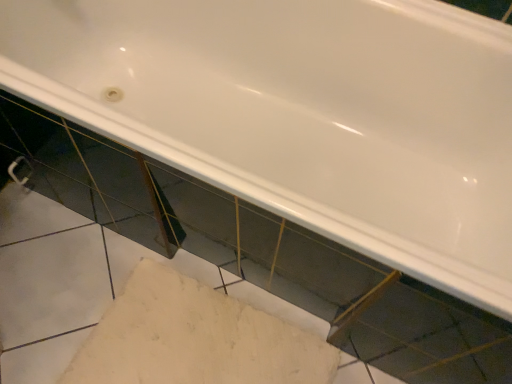
Locate an element on the screen. white plastic towel bar at lower left is located at coordinates (15, 167).

Describe the element at coordinates (15, 167) in the screenshot. I see `white plastic towel bar at lower left` at that location.

This screenshot has height=384, width=512. I want to click on white plastic towel bar at lower left, so click(x=15, y=167).